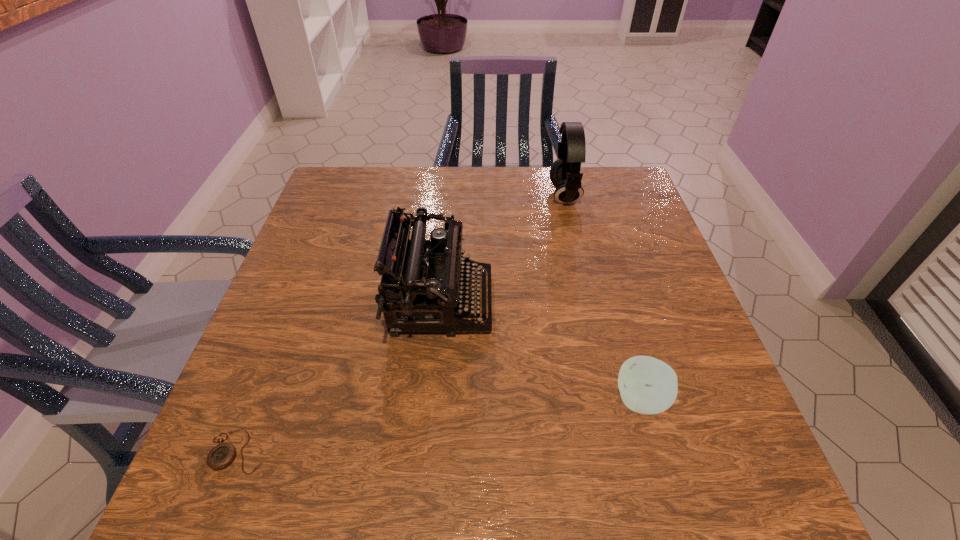
In the image, there is a desktop. In order to click on vacant region at the left edge in this screenshot , I will do `click(330, 279)`.

Where is `free location at the right edge of the desktop`? Image resolution: width=960 pixels, height=540 pixels. free location at the right edge of the desktop is located at coordinates (647, 217).

In the image, there is a desktop. What are the coordinates of `vacant area at the far left corner` in the screenshot? It's located at (348, 180).

I want to click on free region at the far right corner of the desktop, so click(x=634, y=190).

In the image, there is a desktop. At what (x,y) coordinates should I click in order to perform the action: click on free space at the near right corner. Please return your answer as a coordinate pair (x, y). The height and width of the screenshot is (540, 960). Looking at the image, I should click on (693, 467).

Find the location of a particular element. free spot between the third object from right to left and the second shortest object is located at coordinates (540, 351).

Where is `free space that is in between the apple and the earphone`? The height and width of the screenshot is (540, 960). free space that is in between the apple and the earphone is located at coordinates (603, 298).

Where is `vacant region between the apple and the pocket watch`? The width and height of the screenshot is (960, 540). vacant region between the apple and the pocket watch is located at coordinates (440, 426).

Where is `free point between the nearest object and the third object from right to left`? The width and height of the screenshot is (960, 540). free point between the nearest object and the third object from right to left is located at coordinates (339, 376).

Locate an element on the screen. This screenshot has width=960, height=540. vacant region between the leftmost object and the apple is located at coordinates (440, 426).